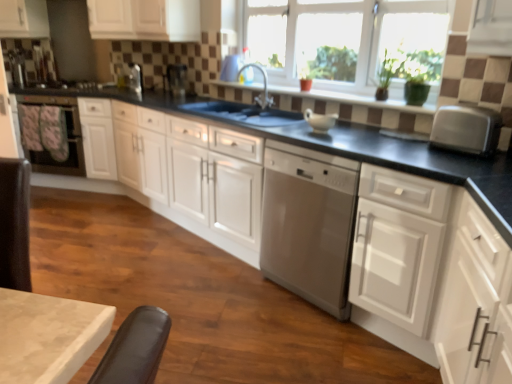
Where is `vacant area that is in front of satin silver dishwasher at center, which is the first home appliance in front-to-back order`? The height and width of the screenshot is (384, 512). vacant area that is in front of satin silver dishwasher at center, which is the first home appliance in front-to-back order is located at coordinates (310, 352).